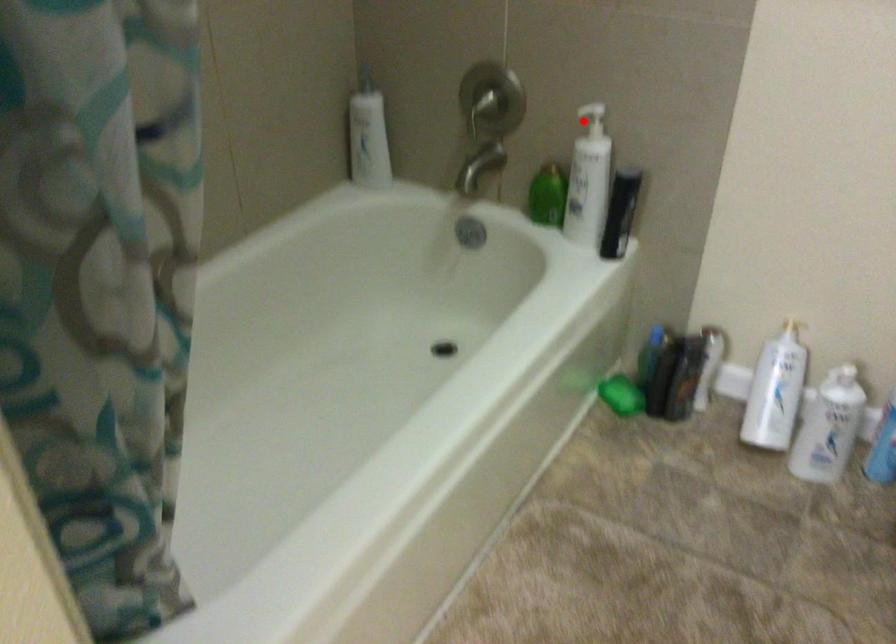
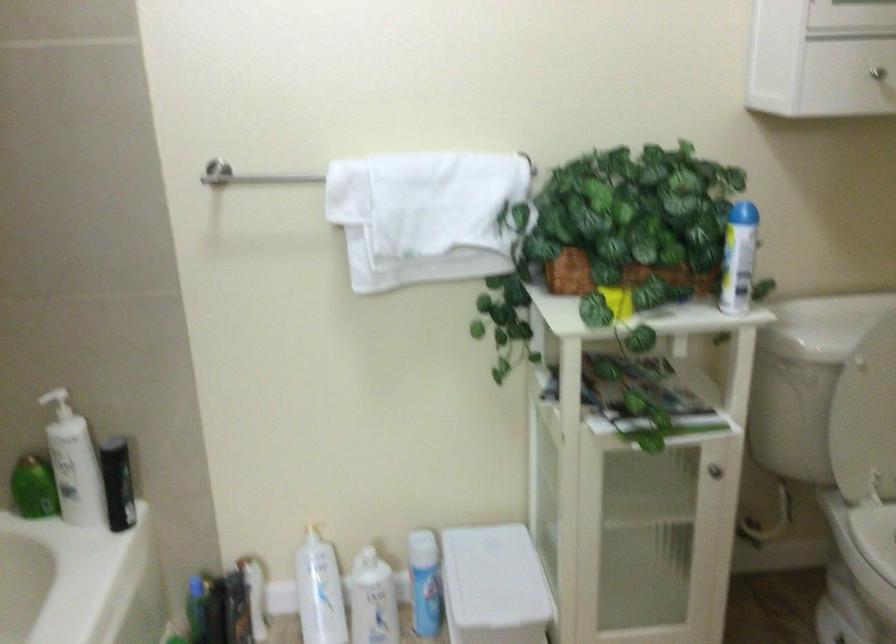
In the second image, find the point that corresponds to the highlighted location in the first image.

(56, 402)